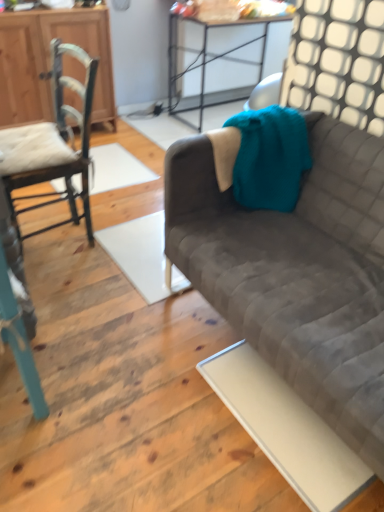
What do you see at coordinates (18, 310) in the screenshot? I see `teal wooden chair at left, the 1th chair viewed from the front` at bounding box center [18, 310].

Where is `teal wooden chair at left, the 1th chair viewed from the front`? teal wooden chair at left, the 1th chair viewed from the front is located at coordinates (18, 310).

At what (x,y) coordinates should I click in order to perform the action: click on wooden chair at left, which appears as the 2th chair when viewed from the front. Please return your answer as a coordinate pair (x, y). The height and width of the screenshot is (512, 384). Looking at the image, I should click on (52, 144).

Can you confirm if wooden cabinet at left is wider than teal wooden chair at left, the second chair positioned from the back?

No.

Which is correct: wooden cabinet at left is inside teal wooden chair at left, the second chair positioned from the back, or outside of it?

wooden cabinet at left is located beyond the bounds of teal wooden chair at left, the second chair positioned from the back.

Is wooden cabinet at left facing towards teal wooden chair at left, the second chair positioned from the back?

Yes, wooden cabinet at left is oriented towards teal wooden chair at left, the second chair positioned from the back.

Is point (235, 87) in front of point (2, 225)?

No, it is behind (2, 225).

Could you tell me if metallic silver table at upper center is facing teal wooden chair at left, the second chair positioned from the back?

No, metallic silver table at upper center is not turned towards teal wooden chair at left, the second chair positioned from the back.

Between metallic silver table at upper center and teal wooden chair at left, the second chair positioned from the back, which one appears on the left side from the viewer's perspective?

teal wooden chair at left, the second chair positioned from the back, is more to the left.

Is metallic silver table at upper center next to teal wooden chair at left, the second chair positioned from the back?

No, metallic silver table at upper center is not beside teal wooden chair at left, the second chair positioned from the back.

How distant is velvet gray couch at right from teal knitted blanket at upper right?

velvet gray couch at right is 9.47 inches from teal knitted blanket at upper right.

The image size is (384, 512). I want to click on blanket above the velvet gray couch at right (from a real-world perspective), so click(x=270, y=157).

Which of these two, velvet gray couch at right or teal knitted blanket at upper right, is wider?

velvet gray couch at right.

From the image's perspective, is velvet gray couch at right above or below teal knitted blanket at upper right?

Based on their image positions, velvet gray couch at right is located beneath teal knitted blanket at upper right.

Is wooden chair at left, which appears as the 2th chair when viewed from the front, wider or thinner than velvet gray couch at right?

Clearly, wooden chair at left, which appears as the 2th chair when viewed from the front, has less width compared to velvet gray couch at right.

From a real-world perspective, is wooden chair at left, which appears as the 2th chair when viewed from the front, above or below velvet gray couch at right?

From a real-world perspective, wooden chair at left, which appears as the 2th chair when viewed from the front, is physically above velvet gray couch at right.

Is the surface of wooden chair at left, placed as the 1th chair when sorted from back to front, in direct contact with velvet gray couch at right?

They are not placed beside each other.

In the scene shown: Is wooden chair at left, which appears as the 2th chair when viewed from the front, oriented towards velvet gray couch at right?

No, wooden chair at left, which appears as the 2th chair when viewed from the front, is not aimed at velvet gray couch at right.

From a real-world perspective, is metallic silver table at upper center beneath wooden cabinet at left?

Correct, in the physical world, metallic silver table at upper center is lower than wooden cabinet at left.

Is metallic silver table at upper center aimed at wooden cabinet at left?

No, metallic silver table at upper center is not oriented towards wooden cabinet at left.

Looking at this image, who is shorter, metallic silver table at upper center or wooden cabinet at left?

metallic silver table at upper center.

Is teal knitted blanket at upper right aimed at wooden chair at left, which appears as the 2th chair when viewed from the front?

No.

The width and height of the screenshot is (384, 512). I want to click on blanket behind the wooden chair at left, placed as the 1th chair when sorted from back to front, so click(x=270, y=157).

Choose the correct answer: Is teal knitted blanket at upper right inside wooden chair at left, placed as the 1th chair when sorted from back to front, or outside it?

teal knitted blanket at upper right is not inside wooden chair at left, placed as the 1th chair when sorted from back to front, it's outside.

Based on the photo, is wooden cabinet at left completely or partially inside teal knitted blanket at upper right?

No, wooden cabinet at left is not inside teal knitted blanket at upper right.

Considering the positions of objects teal knitted blanket at upper right and wooden cabinet at left in the image provided, who is more to the left, teal knitted blanket at upper right or wooden cabinet at left?

wooden cabinet at left is more to the left.

Does point (304, 138) come farther from viewer compared to point (3, 14)?

No, (304, 138) is closer to viewer.

Where is `cabinetry below the teal knitted blanket at upper right (from a real-world perspective)`? cabinetry below the teal knitted blanket at upper right (from a real-world perspective) is located at coordinates click(x=50, y=62).

Image resolution: width=384 pixels, height=512 pixels. In order to click on the 2nd chair in front of the wooden cabinet at left in this screenshot , I will do `click(18, 310)`.

You are a GUI agent. You are given a task and a screenshot of the screen. Output one action in this format:
    pyautogui.click(x=<x>, y=<y>)
    Task: Click on the 2nd chair above the metallic silver table at upper center (from a real-world perspective)
    The width and height of the screenshot is (384, 512).
    Given the screenshot: What is the action you would take?
    pyautogui.click(x=18, y=310)

Based on their spatial positions, is teal knitted blanket at upper right or metallic silver table at upper center closer to wooden chair at left, placed as the 1th chair when sorted from back to front?

teal knitted blanket at upper right is positioned closer to the anchor wooden chair at left, placed as the 1th chair when sorted from back to front.

When comparing their distances from wooden chair at left, which appears as the 2th chair when viewed from the front, does teal wooden chair at left, the second chair positioned from the back, or teal knitted blanket at upper right seem closer?

teal wooden chair at left, the second chair positioned from the back.

Based on their spatial positions, is wooden chair at left, which appears as the 2th chair when viewed from the front, or metallic silver table at upper center closer to teal knitted blanket at upper right?

wooden chair at left, which appears as the 2th chair when viewed from the front, is positioned closer to the anchor teal knitted blanket at upper right.

Which object lies further to the anchor point velvet gray couch at right, wooden chair at left, placed as the 1th chair when sorted from back to front, or wooden cabinet at left?

wooden cabinet at left is positioned further to the anchor velvet gray couch at right.

Estimate the real-world distances between objects in this image. Which object is further from wooden cabinet at left, teal knitted blanket at upper right or teal wooden chair at left, the 1th chair viewed from the front?

teal wooden chair at left, the 1th chair viewed from the front, is further to wooden cabinet at left.

Looking at the image, which one is located closer to wooden cabinet at left, teal knitted blanket at upper right or metallic silver table at upper center?

metallic silver table at upper center is closer to wooden cabinet at left.

Considering their positions, is wooden chair at left, which appears as the 2th chair when viewed from the front, positioned further to metallic silver table at upper center than teal knitted blanket at upper right?

teal knitted blanket at upper right.

Estimate the real-world distances between objects in this image. Which object is further from wooden chair at left, placed as the 1th chair when sorted from back to front, teal wooden chair at left, the 1th chair viewed from the front, or wooden cabinet at left?

Among the two, wooden cabinet at left is located further to wooden chair at left, placed as the 1th chair when sorted from back to front.

Where is `chair positioned between velvet gray couch at right and metallic silver table at upper center from near to far`? The height and width of the screenshot is (512, 384). chair positioned between velvet gray couch at right and metallic silver table at upper center from near to far is located at coordinates (52, 144).

This screenshot has width=384, height=512. What are the coordinates of `chair situated between wooden chair at left, which appears as the 2th chair when viewed from the front, and teal knitted blanket at upper right from left to right` in the screenshot? It's located at (18, 310).

You are a GUI agent. You are given a task and a screenshot of the screen. Output one action in this format:
    pyautogui.click(x=<x>, y=<y>)
    Task: Click on the blanket between wooden cabinet at left and metallic silver table at upper center
    This screenshot has width=384, height=512.
    Given the screenshot: What is the action you would take?
    [x=270, y=157]

Identify the location of studio couch between teal wooden chair at left, the second chair positioned from the back, and wooden cabinet at left from front to back. The height and width of the screenshot is (512, 384). (301, 246).